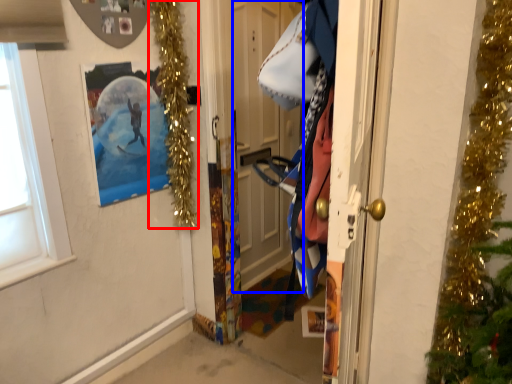
Question: Among these objects, which one is nearest to the camera, christmas light (highlighted by a red box) or door (highlighted by a blue box)?

Choices:
 (A) christmas light
 (B) door

Answer: (A)